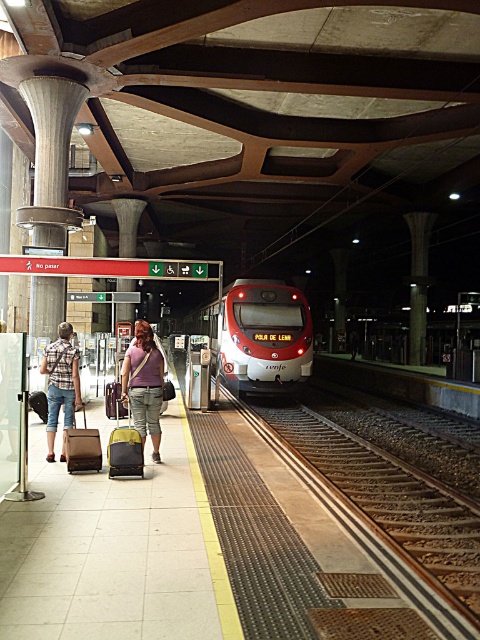
Question: Which object appears farthest from the camera in this image?

Choices:
 (A) yellow fabric suitcase at center
 (B) matte purple shirt at center

Answer: (A)

Question: Which object is closer to the camera taking this photo?

Choices:
 (A) smooth metal train track at center
 (B) yellow fabric suitcase at center
 (C) smooth concrete platform at lower left
 (D) plaid shirt at left

Answer: (A)

Question: Is the position of brown leather suitcase at left less distant than that of yellow fabric suitcase at center?

Choices:
 (A) no
 (B) yes

Answer: (B)

Question: Can you confirm if matte purple shirt at center is positioned to the left of plaid shirt at left?

Choices:
 (A) no
 (B) yes

Answer: (A)

Question: Can you confirm if matte purple shirt at center is bigger than plaid shirt at left?

Choices:
 (A) no
 (B) yes

Answer: (A)

Question: Which of these objects is positioned closest to the plaid shirt at left?

Choices:
 (A) brown leather suitcase at left
 (B) smooth concrete platform at lower left
 (C) red glossy train at center
 (D) smooth metal train track at center

Answer: (A)